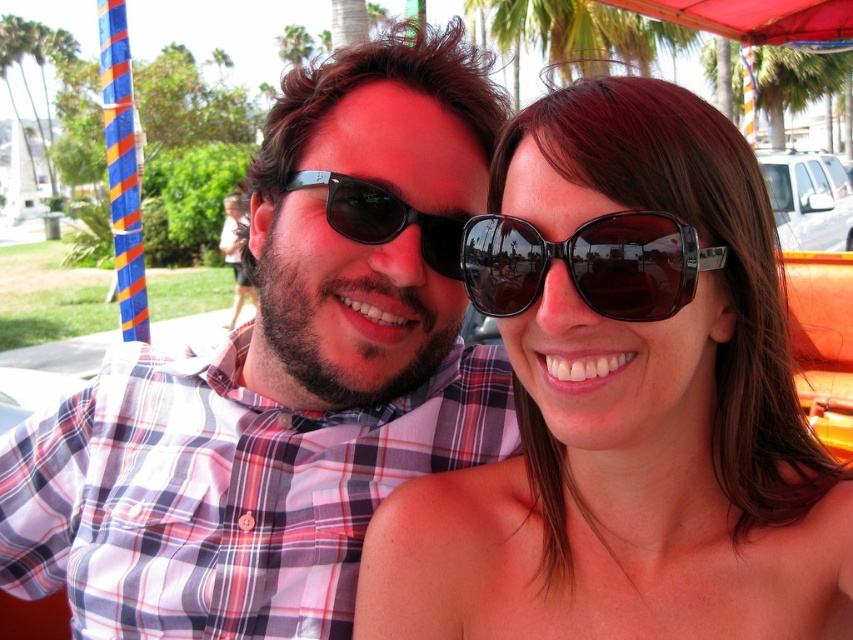
You are holding a camera and want to focus on the point at coordinates point (520,243). The camera has a depth sensor that can measure distances up to 30 inches. Will the point be within the sensor range?

The distance of point (520,243) from camera is 28.40 inches, which is within the sensor range of up to 30 inches. Yes, the point will be within the sensor range.